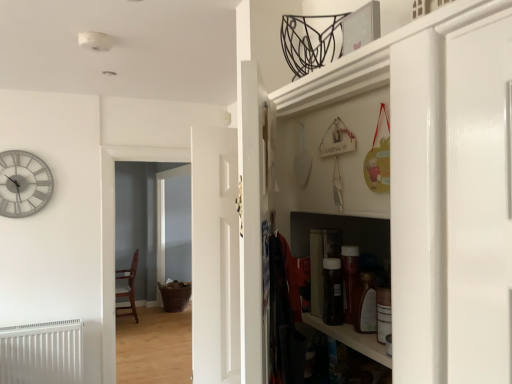
Find the location of a particular element. This screenshot has width=512, height=384. white glossy door at center, acting as the 2th door starting from the back is located at coordinates (254, 219).

The height and width of the screenshot is (384, 512). Describe the element at coordinates (424, 181) in the screenshot. I see `white glossy cabinet at right` at that location.

You are a GUI agent. You are given a task and a screenshot of the screen. Output one action in this format:
    pyautogui.click(x=<x>, y=<y>)
    Task: Click on the wooden chair at left
    The height and width of the screenshot is (384, 512).
    Given the screenshot: What is the action you would take?
    pyautogui.click(x=127, y=287)

What do you see at coordinates (23, 184) in the screenshot?
I see `silver metallic clock at left` at bounding box center [23, 184].

Identify the location of white painted wood door at center, the 1th door from the left. point(215,256).

The height and width of the screenshot is (384, 512). What do you see at coordinates (174, 225) in the screenshot?
I see `brown woven basket at center` at bounding box center [174, 225].

I want to click on white glossy door at center, which is the 2th door in left-to-right order, so click(254, 219).

From the image's perspective, which is below, white glossy cabinet at right or white matte radiator at lower left?

white matte radiator at lower left is shown below in the image.

Locate an element on the screen. This screenshot has height=384, width=512. cabinetry lying in front of the white matte radiator at lower left is located at coordinates (424, 181).

Between white glossy cabinet at right and white matte radiator at lower left, which one has larger width?

Wider between the two is white glossy cabinet at right.

Looking at this image, from a real-world perspective, which object stands above the other?

white glossy cabinet at right is physically above.

Which is closer to the camera, (208, 254) or (478, 236)?

Point (208, 254) appears to be farther away from the viewer than point (478, 236).

How different are the orientations of white painted wood door at center, the 1th door from the left, and white glossy cabinet at right in degrees?

9.15 degrees separate the facing orientations of white painted wood door at center, the 1th door from the left, and white glossy cabinet at right.

Is white painted wood door at center, the 1th door from the left, bigger than white glossy cabinet at right?

No.

Which of these two, white matte radiator at lower left or white painted wood door at center, the second door when ordered from right to left, stands taller?

white painted wood door at center, the second door when ordered from right to left.

Is white matte radiator at lower left oriented away from white painted wood door at center, the 1th door from the left?

No, white painted wood door at center, the 1th door from the left, is not at the back of white matte radiator at lower left.

From the image's perspective, which one is positioned higher, white matte radiator at lower left or white painted wood door at center, arranged as the first door when viewed from the back?

white painted wood door at center, arranged as the first door when viewed from the back, appears higher in the image.

Based on the photo, is white matte radiator at lower left further to the viewer compared to white painted wood door at center, arranged as the first door when viewed from the back?

No.

Does point (406, 199) lie in front of point (45, 202)?

Yes, it is in front of point (45, 202).

Between white glossy cabinet at right and silver metallic clock at left, which one appears on the left side from the viewer's perspective?

silver metallic clock at left.

Is brown woven basket at center oriented away from silver metallic clock at left?

brown woven basket at center is not turned away from silver metallic clock at left.

Is brown woven basket at center wider than silver metallic clock at left?

Correct, the width of brown woven basket at center exceeds that of silver metallic clock at left.

At what (x,y) coordinates should I click in order to perform the action: click on wall clock lying on the left of brown woven basket at center. Please return your answer as a coordinate pair (x, y). Looking at the image, I should click on (23, 184).

Which object is positioned more to the right, brown woven basket at center or silver metallic clock at left?

brown woven basket at center is more to the right.

In the image, is silver metallic clock at left positioned in front of or behind brown woven basket at center?

Visually, silver metallic clock at left is located in front of brown woven basket at center.

From the image's perspective, is silver metallic clock at left on brown woven basket at center?

Yes.

Locate an element on the screen. The height and width of the screenshot is (384, 512). glass door that appears below the silver metallic clock at left (from the image's perspective) is located at coordinates (174, 225).

Measure the distance between silver metallic clock at left and brown woven basket at center.

They are 13.33 feet apart.

Is white glossy cabinet at right shorter than brown woven basket at center?

Correct, white glossy cabinet at right is not as tall as brown woven basket at center.

Does white glossy cabinet at right turn towards brown woven basket at center?

No, white glossy cabinet at right is not oriented towards brown woven basket at center.

What's the angular difference between white glossy cabinet at right and brown woven basket at center's facing directions?

There is a 0.538-degree angle between the facing directions of white glossy cabinet at right and brown woven basket at center.

In the image, there is a white glossy cabinet at right. Identify the location of radiator below it (from a real-world perspective). Image resolution: width=512 pixels, height=384 pixels. (42, 353).

From the white glossy cabinet at right, count the 2nd door to the left and point to it. Please provide its 2D coordinates.

[(215, 256)]

Looking at the image, which one is located closer to white matte radiator at lower left, white painted wood door at center, arranged as the first door when viewed from the back, or silver metallic clock at left?

silver metallic clock at left lies closer to white matte radiator at lower left than the other object.

When comparing their distances from silver metallic clock at left, does wooden chair at left or white matte radiator at lower left seem further?

Based on the image, wooden chair at left appears to be further to silver metallic clock at left.

Which object lies nearer to the anchor point wooden chair at left, white matte radiator at lower left or white glossy cabinet at right?

white matte radiator at lower left is closer to wooden chair at left.

Estimate the real-world distances between objects in this image. Which object is further from silver metallic clock at left, wooden chair at left or white glossy cabinet at right?

wooden chair at left is positioned further to the anchor silver metallic clock at left.

From the image, which object appears to be farther from wooden chair at left, silver metallic clock at left or white matte radiator at lower left?

silver metallic clock at left is positioned further to the anchor wooden chair at left.

Estimate the real-world distances between objects in this image. Which object is further from white painted wood door at center, arranged as the first door when viewed from the back, white glossy door at center, which appears as the first door when viewed from the front, or silver metallic clock at left?

silver metallic clock at left lies further to white painted wood door at center, arranged as the first door when viewed from the back, than the other object.

Based on their spatial positions, is white matte radiator at lower left or wooden chair at left further from white glossy door at center, which is the 2th door in left-to-right order?

wooden chair at left is further to white glossy door at center, which is the 2th door in left-to-right order.

Considering their positions, is white matte radiator at lower left positioned closer to silver metallic clock at left than white painted wood door at center, the second door when ordered from right to left?

white matte radiator at lower left is positioned closer to the anchor silver metallic clock at left.

The width and height of the screenshot is (512, 384). What are the coordinates of `door between white matte radiator at lower left and brown woven basket at center along the z-axis` in the screenshot? It's located at (215, 256).

Image resolution: width=512 pixels, height=384 pixels. Identify the location of door located between white glossy cabinet at right and white painted wood door at center, the 1th door from the left, in the depth direction. (x=254, y=219).

Where is `wall clock positioned between white glossy door at center, which appears as the first door when viewed from the front, and wooden chair at left from near to far`? wall clock positioned between white glossy door at center, which appears as the first door when viewed from the front, and wooden chair at left from near to far is located at coordinates (23, 184).

Identify the location of door positioned between white glossy door at center, the 1th door from the right, and brown woven basket at center from near to far. This screenshot has height=384, width=512. (215, 256).